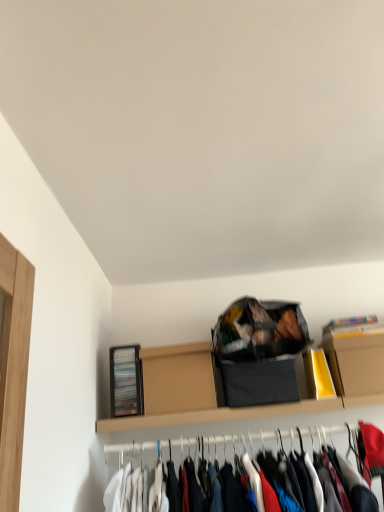
This screenshot has width=384, height=512. Find the location of `brown cardboard box at upper center, which appears as the second cardboard box when viewed from the right`. brown cardboard box at upper center, which appears as the second cardboard box when viewed from the right is located at coordinates (178, 378).

Locate an element on the screen. This screenshot has height=512, width=384. matte black bag at upper center is located at coordinates (259, 330).

Find the location of a particular element. The image size is (384, 512). brown cardboard box at upper center, which appears as the second cardboard box when viewed from the right is located at coordinates (178, 378).

Is brown cardboard box at upper center, which ranks as the 1th cardboard box in left-to-right order, oriented towards matte black bag at upper center?

No, brown cardboard box at upper center, which ranks as the 1th cardboard box in left-to-right order, does not turn towards matte black bag at upper center.

Is point (152, 365) positioned after point (225, 352)?

That is True.

Would you say brown cardboard box at upper center, which appears as the second cardboard box when viewed from the right, is inside or outside matte black bag at upper center?

brown cardboard box at upper center, which appears as the second cardboard box when viewed from the right, exists outside the volume of matte black bag at upper center.

Can you confirm if brown cardboard box at upper center, which ranks as the 1th cardboard box in left-to-right order, is bigger than matte black bag at upper center?

Incorrect, brown cardboard box at upper center, which ranks as the 1th cardboard box in left-to-right order, is not larger than matte black bag at upper center.

Considering the sizes of cardboard box at upper right, arranged as the second cardboard box when viewed from the left, and brown cardboard box at upper center, which appears as the second cardboard box when viewed from the right, in the image, is cardboard box at upper right, arranged as the second cardboard box when viewed from the left, wider or thinner than brown cardboard box at upper center, which appears as the second cardboard box when viewed from the right,?

Clearly, cardboard box at upper right, arranged as the second cardboard box when viewed from the left, has less width compared to brown cardboard box at upper center, which appears as the second cardboard box when viewed from the right.

Is cardboard box at upper right, arranged as the first cardboard box when viewed from the right, not inside brown cardboard box at upper center, which appears as the second cardboard box when viewed from the right?

Indeed, cardboard box at upper right, arranged as the first cardboard box when viewed from the right, is completely outside brown cardboard box at upper center, which appears as the second cardboard box when viewed from the right.

Is cardboard box at upper right, arranged as the first cardboard box when viewed from the right, taller or shorter than brown cardboard box at upper center, which appears as the second cardboard box when viewed from the right?

Considering their sizes, cardboard box at upper right, arranged as the first cardboard box when viewed from the right, has less height than brown cardboard box at upper center, which appears as the second cardboard box when viewed from the right.

Is cardboard box at upper right, arranged as the second cardboard box when viewed from the left, closer to camera compared to brown cardboard box at upper center, which appears as the second cardboard box when viewed from the right?

That is False.

Could you measure the distance between matte black bag at upper center and brown cardboard box at upper center, which appears as the second cardboard box when viewed from the right?

matte black bag at upper center and brown cardboard box at upper center, which appears as the second cardboard box when viewed from the right, are 9.37 inches apart.

From a real-world perspective, is matte black bag at upper center positioned over brown cardboard box at upper center, which appears as the second cardboard box when viewed from the right, based on gravity?

Indeed, from a real-world perspective, matte black bag at upper center stands above brown cardboard box at upper center, which appears as the second cardboard box when viewed from the right.

Based on the photo, between matte black bag at upper center and brown cardboard box at upper center, which ranks as the 1th cardboard box in left-to-right order, which one appears on the left side from the viewer's perspective?

brown cardboard box at upper center, which ranks as the 1th cardboard box in left-to-right order.

Which is nearer, (252, 345) or (186, 379)?

Point (252, 345) is closer to the camera than point (186, 379).

Does matte black bag at upper center appear on the left side of cardboard box at upper right, arranged as the second cardboard box when viewed from the left?

Yes.

Choose the correct answer: Is matte black bag at upper center inside cardboard box at upper right, arranged as the second cardboard box when viewed from the left, or outside it?

matte black bag at upper center is not inside cardboard box at upper right, arranged as the second cardboard box when viewed from the left, it's outside.

Which is behind, point (295, 314) or point (354, 345)?

The point (295, 314) is more distant.

From the image's perspective, who appears lower, matte black bag at upper center or cardboard box at upper right, arranged as the second cardboard box when viewed from the left?

cardboard box at upper right, arranged as the second cardboard box when viewed from the left, from the image's perspective.

Can you confirm if cardboard box at upper right, arranged as the second cardboard box when viewed from the left, is smaller than matte black bag at upper center?

Yes.

From a real-world perspective, which object stands above the other?

In real-world perspective, matte black bag at upper center is above.

Measure the distance between cardboard box at upper right, arranged as the second cardboard box when viewed from the left, and matte black bag at upper center.

The distance of cardboard box at upper right, arranged as the second cardboard box when viewed from the left, from matte black bag at upper center is 11.68 inches.

Considering the positions of objects cardboard box at upper right, arranged as the second cardboard box when viewed from the left, and matte black bag at upper center in the image provided, who is more to the left, cardboard box at upper right, arranged as the second cardboard box when viewed from the left, or matte black bag at upper center?

matte black bag at upper center is more to the left.

Considering the relative sizes of brown cardboard box at upper center, which appears as the second cardboard box when viewed from the right, and cardboard box at upper right, arranged as the second cardboard box when viewed from the left, in the image provided, is brown cardboard box at upper center, which appears as the second cardboard box when viewed from the right, shorter than cardboard box at upper right, arranged as the second cardboard box when viewed from the left,?

No, brown cardboard box at upper center, which appears as the second cardboard box when viewed from the right, is not shorter than cardboard box at upper right, arranged as the second cardboard box when viewed from the left.

Is brown cardboard box at upper center, which appears as the second cardboard box when viewed from the right, facing towards cardboard box at upper right, arranged as the first cardboard box when viewed from the right?

No, brown cardboard box at upper center, which appears as the second cardboard box when viewed from the right, is not oriented towards cardboard box at upper right, arranged as the first cardboard box when viewed from the right.

From the image's perspective, which one is positioned lower, brown cardboard box at upper center, which ranks as the 1th cardboard box in left-to-right order, or cardboard box at upper right, arranged as the first cardboard box when viewed from the right?

From the image's view, brown cardboard box at upper center, which ranks as the 1th cardboard box in left-to-right order, is below.

The width and height of the screenshot is (384, 512). What are the coordinates of `cardboard box lying on the left of matte black bag at upper center` in the screenshot? It's located at pos(178,378).

You are a GUI agent. You are given a task and a screenshot of the screen. Output one action in this format:
    pyautogui.click(x=<x>, y=<y>)
    Task: Click on the cardboard box in front of the cardboard box at upper right, arranged as the first cardboard box when viewed from the right
    This screenshot has width=384, height=512.
    Given the screenshot: What is the action you would take?
    pyautogui.click(x=178, y=378)

Estimate the real-world distances between objects in this image. Which object is further from cardboard box at upper right, arranged as the second cardboard box when viewed from the left, matte black bag at upper center or brown cardboard box at upper center, which ranks as the 1th cardboard box in left-to-right order?

Among the two, brown cardboard box at upper center, which ranks as the 1th cardboard box in left-to-right order, is located further to cardboard box at upper right, arranged as the second cardboard box when viewed from the left.

From the picture: When comparing their distances from cardboard box at upper right, arranged as the first cardboard box when viewed from the right, does brown cardboard box at upper center, which ranks as the 1th cardboard box in left-to-right order, or matte black bag at upper center seem further?

Based on the image, brown cardboard box at upper center, which ranks as the 1th cardboard box in left-to-right order, appears to be further to cardboard box at upper right, arranged as the first cardboard box when viewed from the right.

Considering their positions, is matte black bag at upper center positioned closer to brown cardboard box at upper center, which ranks as the 1th cardboard box in left-to-right order, than cardboard box at upper right, arranged as the second cardboard box when viewed from the left?

matte black bag at upper center lies closer to brown cardboard box at upper center, which ranks as the 1th cardboard box in left-to-right order, than the other object.

When comparing their distances from matte black bag at upper center, does brown cardboard box at upper center, which appears as the second cardboard box when viewed from the right, or cardboard box at upper right, arranged as the second cardboard box when viewed from the left, seem closer?

The object closer to matte black bag at upper center is brown cardboard box at upper center, which appears as the second cardboard box when viewed from the right.

In the scene shown: When comparing their distances from brown cardboard box at upper center, which ranks as the 1th cardboard box in left-to-right order, does cardboard box at upper right, arranged as the first cardboard box when viewed from the right, or matte black bag at upper center seem closer?

The object closer to brown cardboard box at upper center, which ranks as the 1th cardboard box in left-to-right order, is matte black bag at upper center.

Estimate the real-world distances between objects in this image. Which object is closer to matte black bag at upper center, cardboard box at upper right, arranged as the second cardboard box when viewed from the left, or brown cardboard box at upper center, which ranks as the 1th cardboard box in left-to-right order?

The object closer to matte black bag at upper center is brown cardboard box at upper center, which ranks as the 1th cardboard box in left-to-right order.

Locate an element on the screen. The image size is (384, 512). bag located between brown cardboard box at upper center, which ranks as the 1th cardboard box in left-to-right order, and cardboard box at upper right, arranged as the first cardboard box when viewed from the right, in the left-right direction is located at coordinates (259, 330).